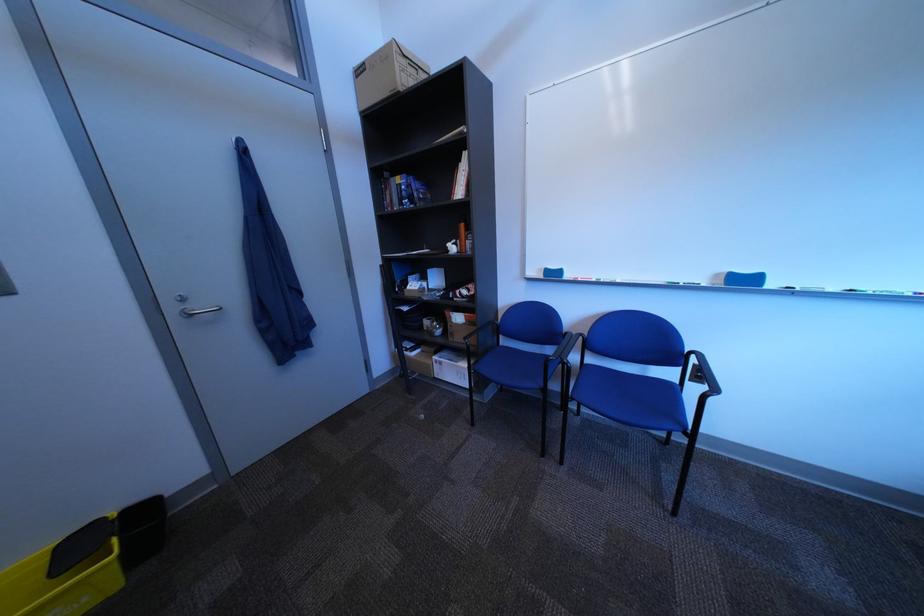
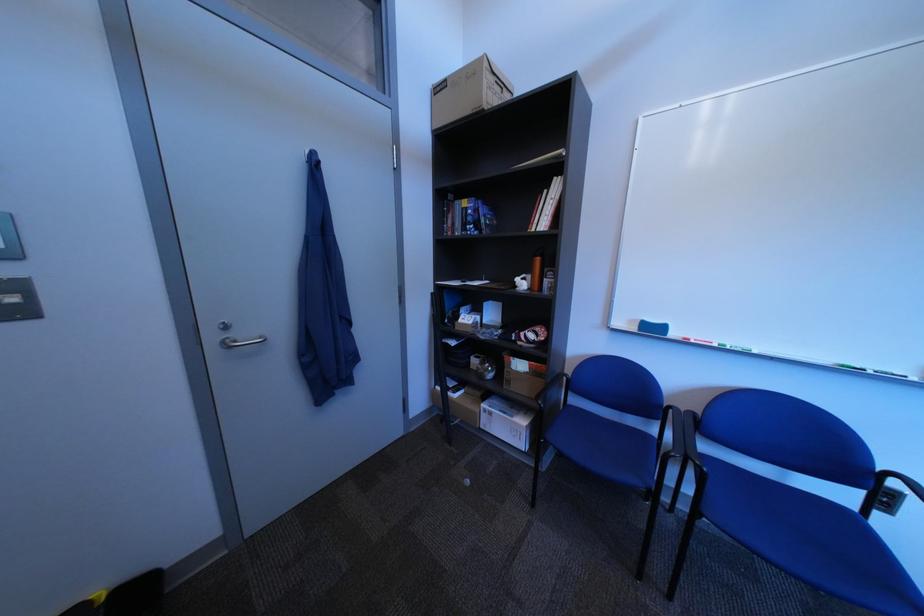
Locate, in the second image, the point that corresponds to point 451,378 in the first image.

(496, 429)